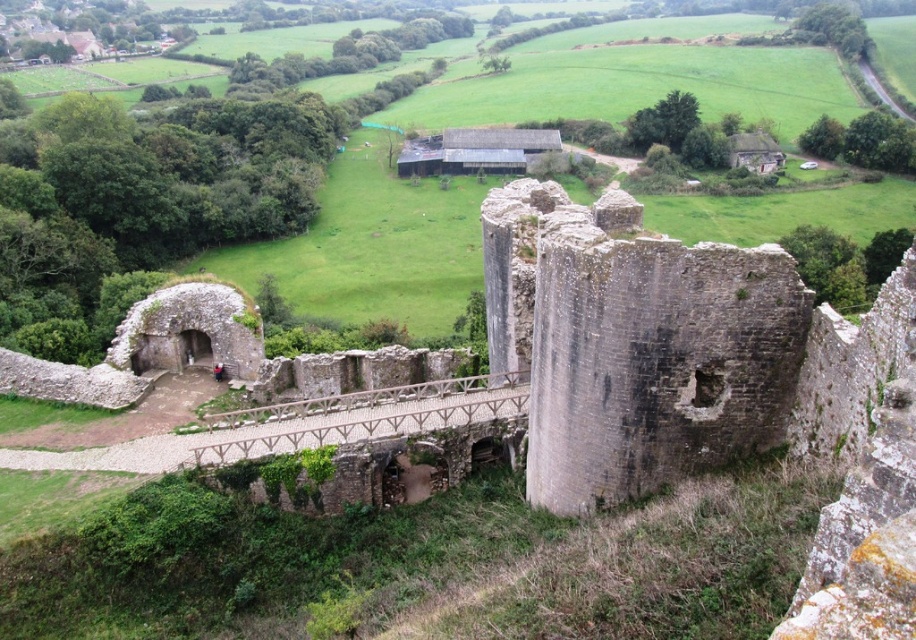
Can you confirm if gray stone ruins at center is thinner than wooden bridge at center?

Yes, gray stone ruins at center is thinner than wooden bridge at center.

Is point (786, 269) farther from viewer compared to point (504, 372)?

That is False.

This screenshot has width=916, height=640. Find the location of `gray stone ruins at center`. gray stone ruins at center is located at coordinates (634, 342).